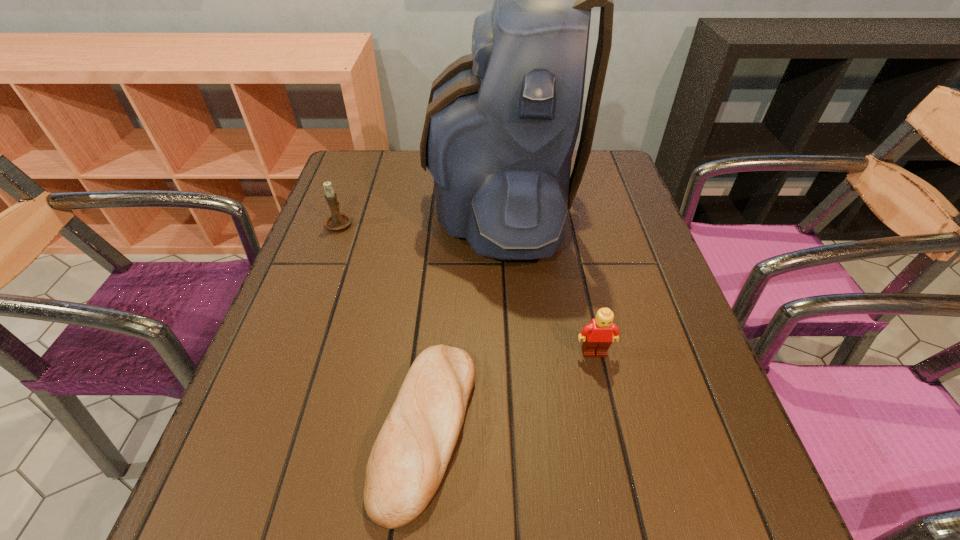
Identify which object is the closest to the leftmost object. Please provide its 2D coordinates. Your answer should be formatted as a tuple, i.e. [(x, y)], where the tuple contains the x and y coordinates of a point satisfying the conditions above.

[(501, 125)]

Find the location of a particular element. object that is the second closest to the Lego is located at coordinates (408, 460).